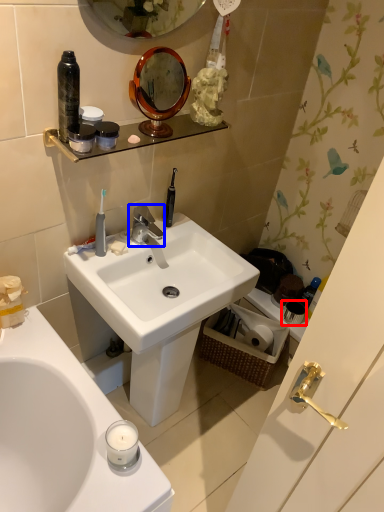
Question: Which point is closer to the camera, toiletry (highlighted by a red box) or tap (highlighted by a blue box)?

Choices:
 (A) toiletry
 (B) tap

Answer: (B)